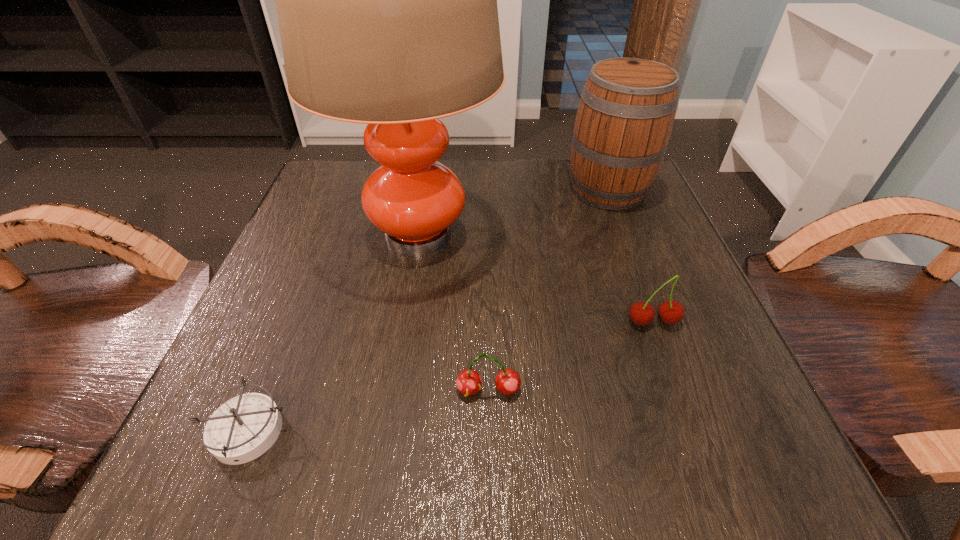
Locate an element on the screen. This screenshot has height=540, width=960. free space between the shortest object and the second tallest object is located at coordinates (428, 310).

At what (x,y) coordinates should I click in order to perform the action: click on free space that is in between the shortest object and the left cherry. Please return your answer as a coordinate pair (x, y). Looking at the image, I should click on (369, 410).

The width and height of the screenshot is (960, 540). I want to click on vacant area between the compass and the lamp, so click(333, 332).

Identify the location of unoccupied position between the second tallest object and the tallest object. point(513,212).

Locate an element on the screen. The width and height of the screenshot is (960, 540). free area in between the compass and the cider is located at coordinates (428, 310).

At what (x,y) coordinates should I click in order to perform the action: click on unoccupied area between the lamp and the shortest object. Please return your answer as a coordinate pair (x, y). This screenshot has width=960, height=540. Looking at the image, I should click on (333, 332).

Locate which object ranks third in proximity to the tallest object. Please provide its 2D coordinates. Your answer should be formatted as a tuple, i.e. [(x, y)], where the tuple contains the x and y coordinates of a point satisfying the conditions above.

[(243, 428)]

Select which object appears as the closest to the shortest object. Please provide its 2D coordinates. Your answer should be formatted as a tuple, i.e. [(x, y)], where the tuple contains the x and y coordinates of a point satisfying the conditions above.

[(386, 0)]